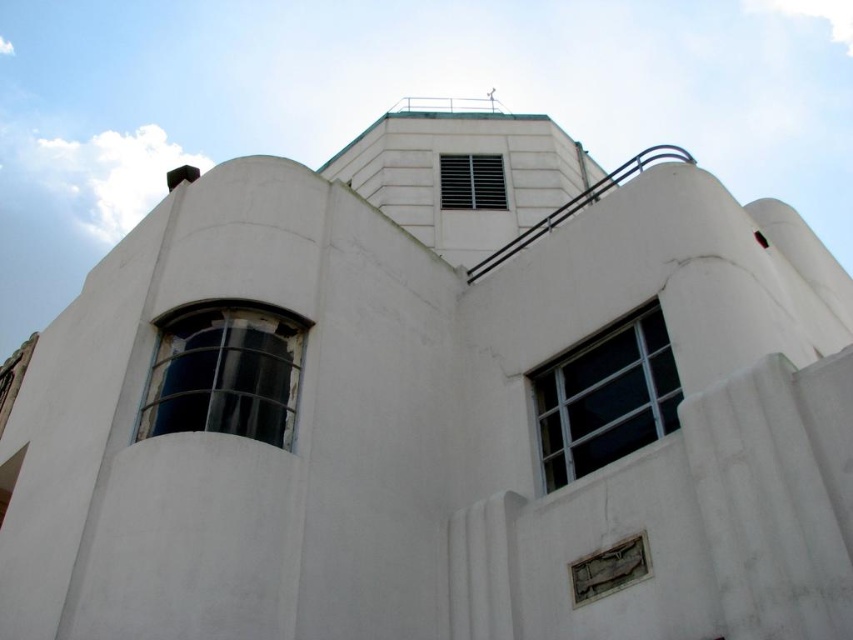
Can you confirm if dark glass window at left is bigger than metallic grid vent at upper center?

No.

Is the position of dark glass window at left more distant than that of metallic grid vent at upper center?

No, dark glass window at left is in front of metallic grid vent at upper center.

Does point (161, 364) come farther from viewer compared to point (445, 157)?

No.

This screenshot has height=640, width=853. I want to click on dark glass window at left, so click(x=225, y=372).

Between dark glass window at left and clear glass window at upper right, which one is positioned higher?

dark glass window at left is above.

Can you confirm if dark glass window at left is wider than clear glass window at upper right?

Correct, the width of dark glass window at left exceeds that of clear glass window at upper right.

Identify the location of dark glass window at left. This screenshot has width=853, height=640. (225, 372).

How distant is clear glass window at upper right from metallic grid vent at upper center?

clear glass window at upper right is 101.06 feet away from metallic grid vent at upper center.

Can you confirm if clear glass window at upper right is positioned below metallic grid vent at upper center?

Yes.

Between point (646, 378) and point (456, 198), which one is positioned behind?

Positioned behind is point (456, 198).

The image size is (853, 640). I want to click on clear glass window at upper right, so click(605, 397).